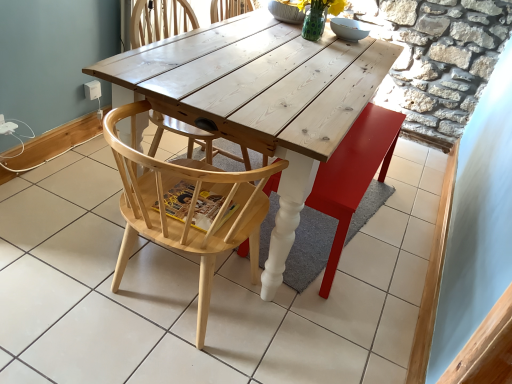
Identify the location of free space above wooden swivel chair at center (from a real-world perspective). The width and height of the screenshot is (512, 384). (362, 145).